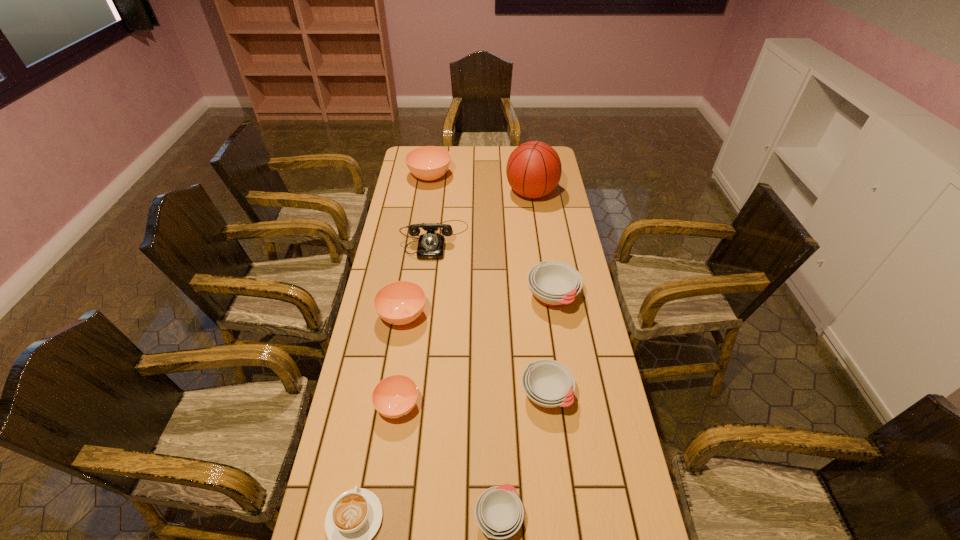
Find the location of a particular element. Image resolution: width=960 pixels, height=540 pixels. vacant space located 0.150m on the front-facing side of the third farthest object is located at coordinates (429, 289).

At what (x,y) coordinates should I click in order to perform the action: click on vacant space located on the front of the biggest white soup bowl. Please return your answer as a coordinate pair (x, y). Looking at the image, I should click on (563, 360).

Image resolution: width=960 pixels, height=540 pixels. Find the location of `vacant area situated 0.310m on the front of the second nearest peach soup bowl`. vacant area situated 0.310m on the front of the second nearest peach soup bowl is located at coordinates (385, 426).

The width and height of the screenshot is (960, 540). What are the coordinates of `vacant position located 0.150m on the left of the second smallest white soup bowl` in the screenshot? It's located at (468, 394).

The image size is (960, 540). I want to click on free space located 0.320m on the back of the smallest peach soup bowl, so click(x=413, y=305).

Find the location of a particular element. The height and width of the screenshot is (540, 960). object positioned at the far edge is located at coordinates (428, 163).

The image size is (960, 540). I want to click on telephone situated at the left edge, so (x=431, y=245).

This screenshot has height=540, width=960. What are the coordinates of `basketball present at the right edge` in the screenshot? It's located at (533, 170).

Identify the location of object present at the far left corner. (428, 163).

Where is `free region at the far edge`? free region at the far edge is located at coordinates (506, 168).